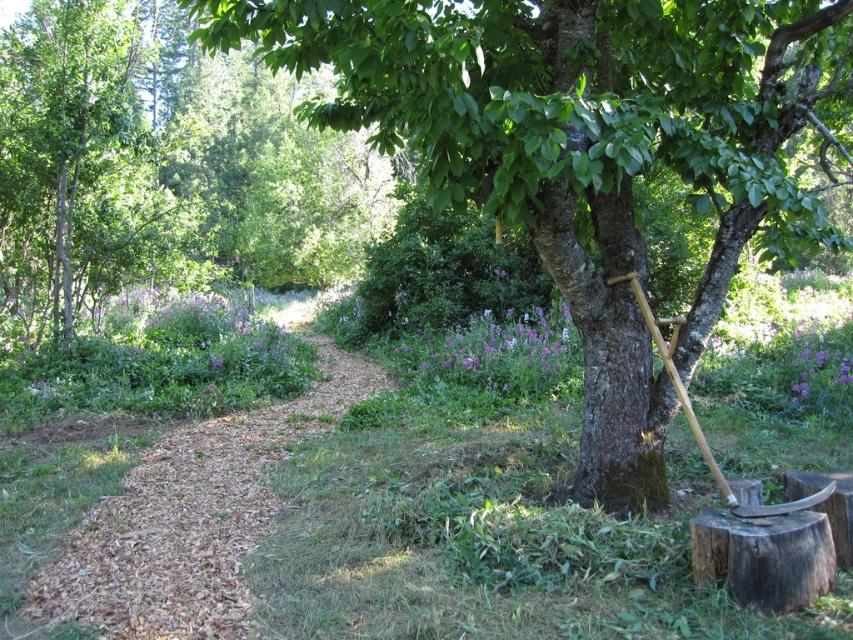
Which is more to the left, green rough bark tree at center or wooden shovel at tree right?

green rough bark tree at center is more to the left.

Does green rough bark tree at center have a greater height compared to wooden shovel at tree right?

Yes, green rough bark tree at center is taller than wooden shovel at tree right.

What do you see at coordinates (579, 148) in the screenshot? Image resolution: width=853 pixels, height=640 pixels. I see `green rough bark tree at center` at bounding box center [579, 148].

Find the location of a particular element. The image size is (853, 640). green rough bark tree at center is located at coordinates (579, 148).

Is brown mulch trail at center further to the viewer compared to wooden shovel at tree right?

Yes, brown mulch trail at center is behind wooden shovel at tree right.

Based on the photo, is brown mulch trail at center smaller than wooden shovel at tree right?

Yes.

Who is more distant from viewer, (183,520) or (618,280)?

The point (183,520) is more distant.

Where is `brown mulch trail at center`? This screenshot has width=853, height=640. brown mulch trail at center is located at coordinates (189, 518).

Is point (38, 310) behind point (618, 278)?

Yes, it is.

Where is `green leafy tree at upper left`? The image size is (853, 640). green leafy tree at upper left is located at coordinates (80, 172).